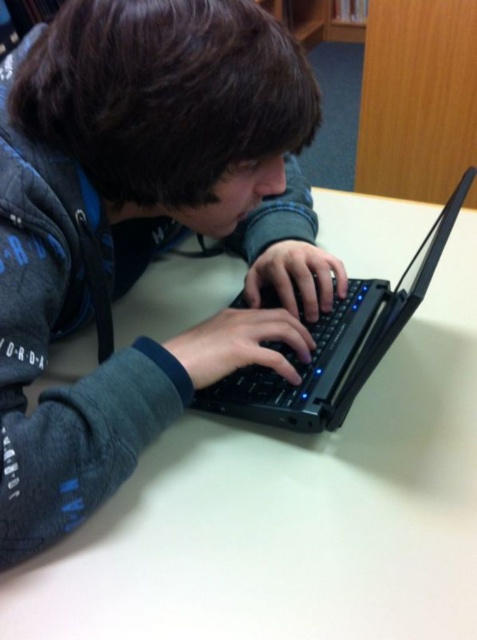
You are a furniture designer who needs to place a new lamp on the white matte table at center so that it doesn not block the view of the black plastic laptop at center. Based on the scene description, can the lamp be placed on the table without obstructing the laptop?

The white matte table at center is taller than black plastic laptop at center, so placing the lamp on the table would not block the view of the laptop since the table provides enough height and space.

You are a person who wants to place a small notebook on the white matte table at center without blocking the black plastic laptop at center. Based on their positions, is there enough space on the table for the notebook?

The white matte table at center is in front of the black plastic laptop at center, so there is space available on the table in front of the laptop where the notebook can be placed without blocking it.

You are organizing a study area and need to place a 12x12 inch square organizer on the table. Given the white matte table at center and the black plastic laptop at center, will there be enough space on the table to place the organizer without moving the laptop?

The white matte table at center is larger in size compared to the black plastic laptop at center, so there is likely enough space to place the 12x12 inch square organizer without moving the laptop.